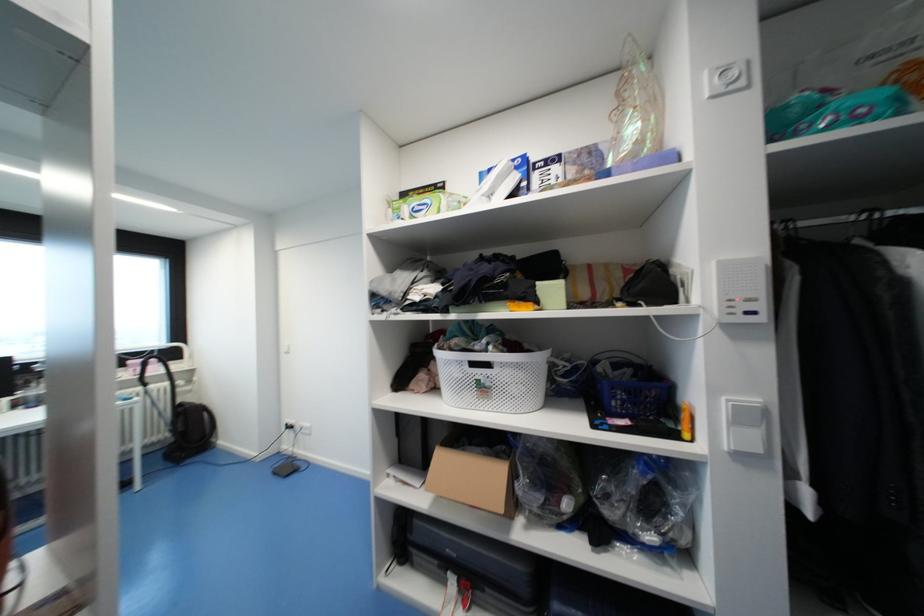
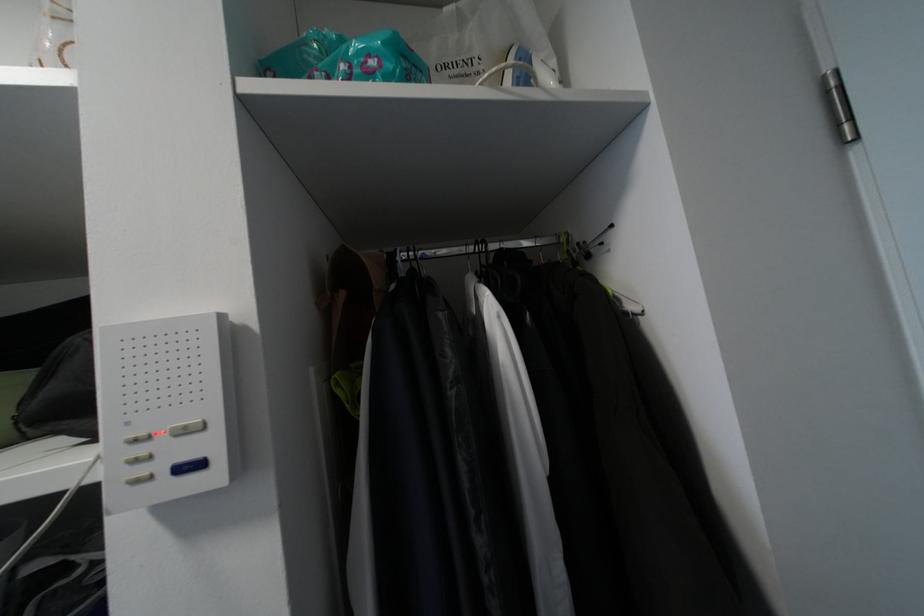
The point at (857, 217) is marked in the first image. Where is the corresponding point in the second image?

(476, 251)